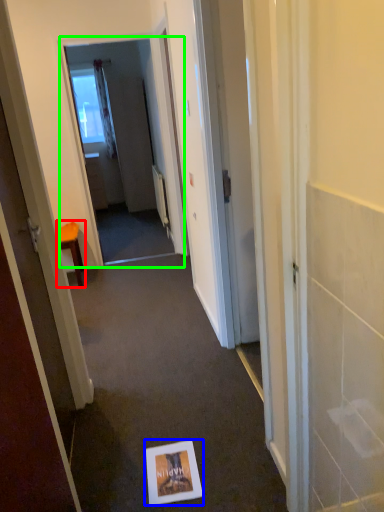
Question: Considering the real-world distances, which object is farthest from furniture (highlighted by a red box)? postcard (highlighted by a blue box) or screen door (highlighted by a green box)?

Choices:
 (A) postcard
 (B) screen door

Answer: (A)